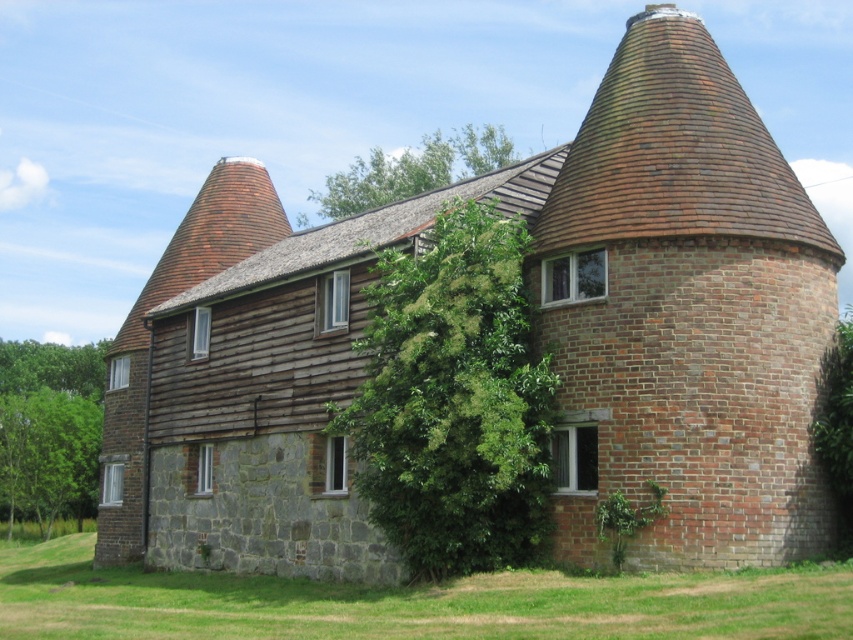
You are an architect designing a garden layout next to the oast house. You have two green leafy trees to place. The first is the green leafy tree at center and the second is the green leafy tree at upper center. Which tree requires a wider planting area to accommodate its spread?

The green leafy tree at upper center requires a wider planting area because its width is greater than the green leafy tree at center.

You are an architect designing a new garden layout around the red brick chimney at center and the green leafy tree at lower left. Which object has a smaller width, requiring more careful placement to ensure it doesn not obstruct pathways?

The red brick chimney at center has a smaller width than the green leafy tree at lower left, so it requires more careful placement to ensure it does not obstruct pathways.